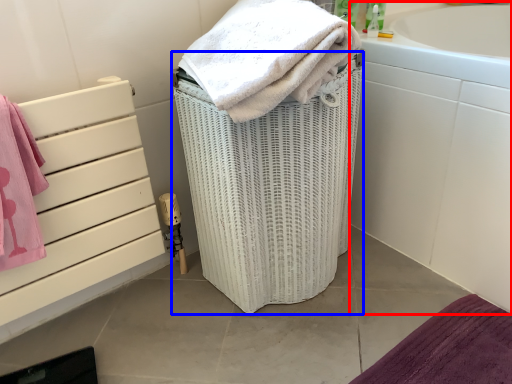
Question: Among these objects, which one is farthest to the camera, bath (highlighted by a red box) or basket container (highlighted by a blue box)?

Choices:
 (A) bath
 (B) basket container

Answer: (A)